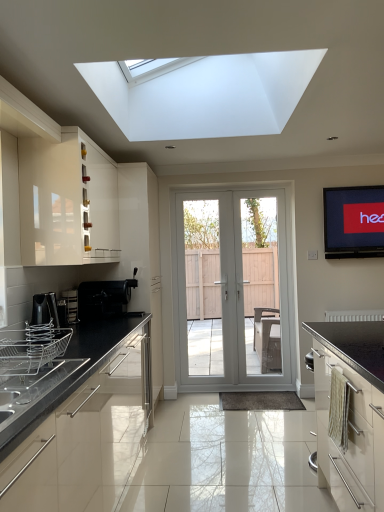
The image size is (384, 512). What do you see at coordinates (206, 289) in the screenshot?
I see `white glossy screen door at center, placed as the second screen door when sorted from right to left` at bounding box center [206, 289].

What do you see at coordinates (71, 305) in the screenshot? This screenshot has height=512, width=384. I see `satin silver toaster at left, placed as the second appliance when sorted from back to front` at bounding box center [71, 305].

What do you see at coordinates (262, 286) in the screenshot? Image resolution: width=384 pixels, height=512 pixels. I see `white glossy door at center, acting as the second screen door starting from the left` at bounding box center [262, 286].

Image resolution: width=384 pixels, height=512 pixels. What are the coordinates of `metallic silver dish rack at left, the 3th appliance viewed from the back` in the screenshot? It's located at (45, 309).

Image resolution: width=384 pixels, height=512 pixels. What are the coordinates of `matte black tv at upper right` in the screenshot? It's located at (353, 221).

Measure the distance between matte black oven at lower right, marked as the first cabinetry in a front-to-back arrangement, and camera.

The distance of matte black oven at lower right, marked as the first cabinetry in a front-to-back arrangement, from camera is 4.83 feet.

The height and width of the screenshot is (512, 384). What do you see at coordinates (350, 411) in the screenshot?
I see `matte black oven at lower right, acting as the 1th cabinetry starting from the bottom` at bounding box center [350, 411].

Where is `white glossy door at center`? This screenshot has width=384, height=512. white glossy door at center is located at coordinates (236, 295).

Locate an element on the screen. The image size is (384, 512). the 4th appliance below the glossy white cabinet at upper left, the 2th cabinetry from the front (from a real-world perspective) is located at coordinates [31, 348].

Which of these two, glossy white cabinet at upper left, the first cabinetry from the top, or satin silver dish rack at left, which is the fourth appliance from back to front, is wider?

glossy white cabinet at upper left, the first cabinetry from the top, is wider.

Can you confirm if glossy white cabinet at upper left, the 2th cabinetry from the front, is positioned to the left of satin silver dish rack at left, the first appliance viewed from the front?

Yes, glossy white cabinet at upper left, the 2th cabinetry from the front, is to the left of satin silver dish rack at left, the first appliance viewed from the front.

How much distance is there between glossy white cabinet at upper left, which is counted as the first cabinetry, starting from the left, and satin silver dish rack at left, which is the fourth appliance from back to front?

The distance of glossy white cabinet at upper left, which is counted as the first cabinetry, starting from the left, from satin silver dish rack at left, which is the fourth appliance from back to front, is 29.83 inches.

From the image's perspective, is white glossy door at center, acting as the second screen door starting from the left, located above or below metallic silver dish rack at left, which is the 2th appliance in front-to-back order?

white glossy door at center, acting as the second screen door starting from the left, is above metallic silver dish rack at left, which is the 2th appliance in front-to-back order.

Between white glossy door at center, acting as the second screen door starting from the left, and metallic silver dish rack at left, which is the 2th appliance in front-to-back order, which one has larger size?

white glossy door at center, acting as the second screen door starting from the left, is bigger.

Which of these two, white glossy door at center, which ranks as the first screen door in right-to-left order, or metallic silver dish rack at left, which is the 2th appliance in front-to-back order, is wider?

Wider between the two is metallic silver dish rack at left, which is the 2th appliance in front-to-back order.

From a real-world perspective, is white glossy door at center, which ranks as the first screen door in right-to-left order, below metallic silver dish rack at left, the 3th appliance viewed from the back?

Yes, from a real-world perspective, white glossy door at center, which ranks as the first screen door in right-to-left order, is beneath metallic silver dish rack at left, the 3th appliance viewed from the back.

Is matte black oven at lower right, acting as the second cabinetry starting from the top, beside matte black tv at upper right?

There is a gap between matte black oven at lower right, acting as the second cabinetry starting from the top, and matte black tv at upper right.

From the image's perspective, which one is positioned higher, matte black oven at lower right, acting as the 2th cabinetry starting from the back, or matte black tv at upper right?

From the image's view, matte black tv at upper right is above.

Which of these two, matte black oven at lower right, the second cabinetry positioned from the left, or matte black tv at upper right, is thinner?

Thinner between the two is matte black tv at upper right.

Is matte black oven at lower right, acting as the 2th cabinetry starting from the back, facing away from matte black tv at upper right?

No, matte black tv at upper right is not at the back of matte black oven at lower right, acting as the 2th cabinetry starting from the back.

Does satin silver toaster at left, placed as the second appliance when sorted from back to front, turn towards white glossy door at center, which ranks as the first screen door in right-to-left order?

No, satin silver toaster at left, placed as the second appliance when sorted from back to front, is not turned towards white glossy door at center, which ranks as the first screen door in right-to-left order.

Which of these two, satin silver toaster at left, the 3th appliance from the front, or white glossy door at center, which ranks as the first screen door in right-to-left order, is bigger?

With larger size is white glossy door at center, which ranks as the first screen door in right-to-left order.

Looking at this image, from the image's perspective, between satin silver toaster at left, the 3th appliance from the front, and white glossy door at center, which ranks as the first screen door in right-to-left order, which one is located above?

white glossy door at center, which ranks as the first screen door in right-to-left order.

Which object is more forward, satin silver toaster at left, the 3th appliance from the front, or white glossy door at center, acting as the second screen door starting from the left?

satin silver toaster at left, the 3th appliance from the front, is more forward.

Does black matte coffee machine at left, the first appliance positioned from the back, have a lesser height compared to matte black tv at upper right?

Correct, black matte coffee machine at left, the first appliance positioned from the back, is not as tall as matte black tv at upper right.

Between black matte coffee machine at left, placed as the 4th appliance when sorted from front to back, and matte black tv at upper right, which one has larger size?

black matte coffee machine at left, placed as the 4th appliance when sorted from front to back.

Could you tell me if black matte coffee machine at left, placed as the 4th appliance when sorted from front to back, is facing matte black tv at upper right?

No, black matte coffee machine at left, placed as the 4th appliance when sorted from front to back, is not facing towards matte black tv at upper right.

From the image's perspective, is matte black tv at upper right beneath satin silver toaster at left, placed as the second appliance when sorted from back to front?

No, from the image's perspective, matte black tv at upper right is not below satin silver toaster at left, placed as the second appliance when sorted from back to front.

From a real-world perspective, who is located higher, matte black tv at upper right or satin silver toaster at left, placed as the second appliance when sorted from back to front?

From a 3D spatial view, matte black tv at upper right is above.

What's the angular difference between matte black tv at upper right and satin silver toaster at left, the 3th appliance from the front,'s facing directions?

The angular difference between matte black tv at upper right and satin silver toaster at left, the 3th appliance from the front, is 88.6 degrees.

Is matte black tv at upper right bigger or smaller than satin silver toaster at left, placed as the second appliance when sorted from back to front?

Considering their sizes, matte black tv at upper right takes up more space than satin silver toaster at left, placed as the second appliance when sorted from back to front.

Considering the relative sizes of metallic silver dish rack at left, the 3th appliance viewed from the back, and satin silver toaster at left, placed as the second appliance when sorted from back to front, in the image provided, is metallic silver dish rack at left, the 3th appliance viewed from the back, shorter than satin silver toaster at left, placed as the second appliance when sorted from back to front,?

No.

Is metallic silver dish rack at left, the 3th appliance viewed from the back, oriented away from satin silver toaster at left, the 3th appliance from the front?

metallic silver dish rack at left, the 3th appliance viewed from the back, does not have its back to satin silver toaster at left, the 3th appliance from the front.

Considering the positions of points (36, 313) and (76, 305), is point (36, 313) farther from camera compared to point (76, 305)?

No, it is not.

Measure the distance between metallic silver dish rack at left, the 3th appliance viewed from the back, and satin silver toaster at left, placed as the second appliance when sorted from back to front.

metallic silver dish rack at left, the 3th appliance viewed from the back, is 17.39 inches away from satin silver toaster at left, placed as the second appliance when sorted from back to front.

This screenshot has width=384, height=512. In order to click on the 2nd appliance in front of the glossy white cabinet at upper left, which ranks as the 2th cabinetry in right-to-left order, counting from the anchor's position in this screenshot , I will do `click(31, 348)`.

Locate an element on the screen. This screenshot has width=384, height=512. the 2nd screen door to the right of the metallic silver dish rack at left, which is the 2th appliance in front-to-back order, starting your count from the anchor is located at coordinates (262, 286).

Looking at the image, which one is located further to white glossy door at center, white glossy screen door at center, placed as the second screen door when sorted from right to left, or matte black tv at upper right?

matte black tv at upper right.

Considering their positions, is matte black tv at upper right positioned closer to white glossy door at center than white glossy door at center, which ranks as the first screen door in right-to-left order?

white glossy door at center, which ranks as the first screen door in right-to-left order, lies closer to white glossy door at center than the other object.

Considering their positions, is black matte coffee machine at left, the first appliance positioned from the back, positioned further to satin silver toaster at left, placed as the second appliance when sorted from back to front, than glossy white cabinet at upper left, arranged as the first cabinetry when viewed from the back?

glossy white cabinet at upper left, arranged as the first cabinetry when viewed from the back.

Which object lies further to the anchor point satin silver dish rack at left, which is the fourth appliance from back to front, matte black tv at upper right or white glossy screen door at center, the 1th screen door positioned from the left?

matte black tv at upper right is further to satin silver dish rack at left, which is the fourth appliance from back to front.

From the image, which object appears to be farther from metallic silver dish rack at left, which is the 2th appliance in front-to-back order, matte black oven at lower right, the second cabinetry positioned from the left, or glossy white cabinet at upper left, the 2th cabinetry from the front?

The object further to metallic silver dish rack at left, which is the 2th appliance in front-to-back order, is matte black oven at lower right, the second cabinetry positioned from the left.

Considering their positions, is white glossy door at center positioned further to glossy white cabinet at upper left, which ranks as the 2th cabinetry in right-to-left order, than metallic silver dish rack at left, which is the 2th appliance in front-to-back order?

white glossy door at center lies further to glossy white cabinet at upper left, which ranks as the 2th cabinetry in right-to-left order, than the other object.

Looking at the image, which one is located further to black matte coffee machine at left, the first appliance positioned from the back, satin silver dish rack at left, the first appliance viewed from the front, or satin silver toaster at left, the 3th appliance from the front?

satin silver dish rack at left, the first appliance viewed from the front, is further to black matte coffee machine at left, the first appliance positioned from the back.

From the image, which object appears to be farther from satin silver dish rack at left, the first appliance viewed from the front, matte black oven at lower right, acting as the 2th cabinetry starting from the back, or glossy white cabinet at upper left, the 2th cabinetry from the front?

Among the two, matte black oven at lower right, acting as the 2th cabinetry starting from the back, is located further to satin silver dish rack at left, the first appliance viewed from the front.

The height and width of the screenshot is (512, 384). Identify the location of cabinetry between matte black oven at lower right, the second cabinetry positioned from the left, and white glossy door at center, acting as the second screen door starting from the left, along the z-axis. (67, 202).

The width and height of the screenshot is (384, 512). What are the coordinates of `cabinetry between satin silver dish rack at left, the first appliance viewed from the front, and white glossy door at center from front to back` in the screenshot? It's located at (67, 202).

The height and width of the screenshot is (512, 384). Find the location of `appliance between metallic silver dish rack at left, which is the 2th appliance in front-to-back order, and black matte coffee machine at left, the first appliance positioned from the back, along the z-axis`. appliance between metallic silver dish rack at left, which is the 2th appliance in front-to-back order, and black matte coffee machine at left, the first appliance positioned from the back, along the z-axis is located at coordinates (71, 305).

At what (x,y) coordinates should I click in order to perform the action: click on door between white glossy screen door at center, placed as the second screen door when sorted from right to left, and matte black tv at upper right, in the horizontal direction. Please return your answer as a coordinate pair (x, y). Looking at the image, I should click on (236, 295).